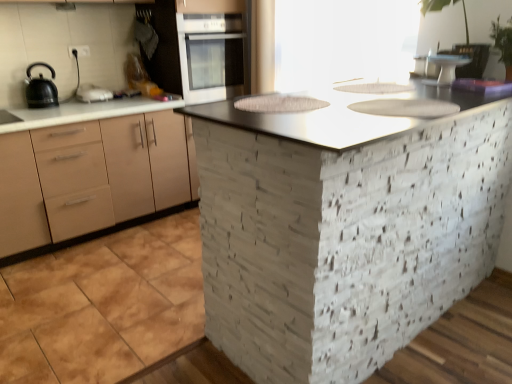
Identify the location of free location to the right of matte black kettle at left. (133, 97).